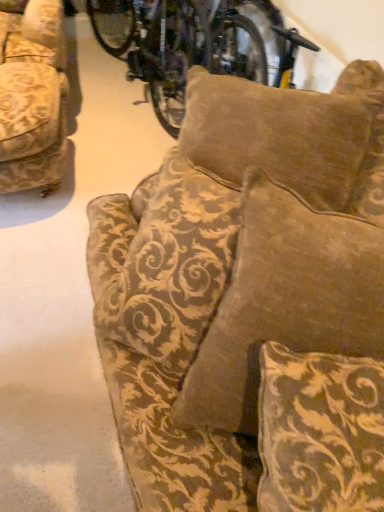
Locate an element on the screen. The width and height of the screenshot is (384, 512). gold-patterned fabric couch at left, positioned as the 1th studio couch in left-to-right order is located at coordinates (33, 100).

What is the approximate height of velvet gold-patterned couch at center, which is the first studio couch from bottom to top?

It is 69.90 centimeters.

Find the location of `metallic silver bicycle at upper center`. metallic silver bicycle at upper center is located at coordinates (191, 45).

This screenshot has height=512, width=384. Describe the element at coordinates (191, 45) in the screenshot. I see `metallic silver bicycle at upper center` at that location.

In order to face velvet gold-patterned pillow at center, the 1th pillow from the front, should I rotate leftwards or rightwards?

Turn right approximately 20.818 degrees to face it.

This screenshot has height=512, width=384. I want to click on gold-patterned fabric couch at left, which is the second studio couch from bottom to top, so click(33, 100).

Is metallic silver bicycle at upper center shorter than brown velvety pillow at upper center, the 2th pillow from the front?

Correct, metallic silver bicycle at upper center is not as tall as brown velvety pillow at upper center, the 2th pillow from the front.

How many degrees apart are the facing directions of metallic silver bicycle at upper center and brown velvety pillow at upper center, the 1th pillow positioned from the back?

The angular difference between metallic silver bicycle at upper center and brown velvety pillow at upper center, the 1th pillow positioned from the back, is 0.000387 degrees.

In terms of width, does metallic silver bicycle at upper center look wider or thinner when compared to brown velvety pillow at upper center, the 1th pillow positioned from the back?

In the image, metallic silver bicycle at upper center appears to be more narrow than brown velvety pillow at upper center, the 1th pillow positioned from the back.

From a real-world perspective, is metallic silver bicycle at upper center positioned under brown velvety pillow at upper center, which is the 1th pillow in top-to-bottom order, based on gravity?

Correct, in the physical world, metallic silver bicycle at upper center is lower than brown velvety pillow at upper center, which is the 1th pillow in top-to-bottom order.

In the scene shown: From a real-world perspective, is velvet gold-patterned couch at center, positioned as the first studio couch in right-to-left order, physically located above or below metallic silver bicycle at upper center?

velvet gold-patterned couch at center, positioned as the first studio couch in right-to-left order, is situated higher than metallic silver bicycle at upper center in the real world.

Based on their positions, is velvet gold-patterned couch at center, marked as the 2th studio couch in a left-to-right arrangement, located to the left or right of metallic silver bicycle at upper center?

In the image, velvet gold-patterned couch at center, marked as the 2th studio couch in a left-to-right arrangement, appears on the right side of metallic silver bicycle at upper center.

Is point (178, 329) positioned after point (186, 65)?

No, (178, 329) is closer to viewer.

Locate an element on the screen. The image size is (384, 512). bicycle directly beneath the velvet gold-patterned couch at center, arranged as the first studio couch when viewed from the front (from a real-world perspective) is located at coordinates (191, 45).

This screenshot has width=384, height=512. What are the coordinates of `bicycle on the right side of gold-patterned fabric couch at left, marked as the second studio couch in a right-to-left arrangement` in the screenshot? It's located at (191, 45).

From a real-world perspective, is gold-patterned fabric couch at left, positioned as the 1th studio couch in left-to-right order, physically located above or below metallic silver bicycle at upper center?

Clearly, from a real-world perspective, gold-patterned fabric couch at left, positioned as the 1th studio couch in left-to-right order, is below metallic silver bicycle at upper center.

Consider the image. Could you tell me if gold-patterned fabric couch at left, which ranks as the 1th studio couch in top-to-bottom order, is turned towards metallic silver bicycle at upper center?

No, gold-patterned fabric couch at left, which ranks as the 1th studio couch in top-to-bottom order, is not oriented towards metallic silver bicycle at upper center.

What's the angular difference between brown velvety pillow at upper center, the 2th pillow from the front, and velvet gold-patterned pillow at center, the 1th pillow from the front,'s facing directions?

The angle between the facing direction of brown velvety pillow at upper center, the 2th pillow from the front, and the facing direction of velvet gold-patterned pillow at center, the 1th pillow from the front, is 73.1 degrees.

Considering the relative sizes of brown velvety pillow at upper center, the 1th pillow positioned from the back, and velvet gold-patterned pillow at center, the second pillow in the back-to-front sequence, in the image provided, is brown velvety pillow at upper center, the 1th pillow positioned from the back, wider than velvet gold-patterned pillow at center, the second pillow in the back-to-front sequence,?

Yes.

Does brown velvety pillow at upper center, placed as the 2th pillow when sorted from bottom to top, come behind velvet gold-patterned pillow at center, the second pillow in the back-to-front sequence?

Yes, it is.

Does brown velvety pillow at upper center, which is the 1th pillow in top-to-bottom order, turn towards velvet gold-patterned pillow at center, which is the first pillow in bottom-to-top order?

No.

Who is more distant, velvet gold-patterned pillow at center, the 2th pillow when ordered from top to bottom, or velvet gold-patterned couch at center, arranged as the first studio couch when viewed from the front?

velvet gold-patterned pillow at center, the 2th pillow when ordered from top to bottom, is further from the camera.

Which object is wider, velvet gold-patterned pillow at center, the 1th pillow from the front, or velvet gold-patterned couch at center, positioned as the first studio couch in right-to-left order?

velvet gold-patterned couch at center, positioned as the first studio couch in right-to-left order, is wider.

From the image's perspective, would you say velvet gold-patterned pillow at center, the second pillow in the back-to-front sequence, is shown under velvet gold-patterned couch at center, which is the first studio couch from bottom to top?

Yes.

Is velvet gold-patterned pillow at center, the 2th pillow when ordered from top to bottom, to the left or to the right of velvet gold-patterned couch at center, positioned as the first studio couch in right-to-left order, in the image?

From the image, it's evident that velvet gold-patterned pillow at center, the 2th pillow when ordered from top to bottom, is to the right of velvet gold-patterned couch at center, positioned as the first studio couch in right-to-left order.

In the scene shown: Is brown velvety pillow at upper center, the 2th pillow from the front, completely or partially outside of velvet gold-patterned couch at center, positioned as the first studio couch in right-to-left order?

Indeed, brown velvety pillow at upper center, the 2th pillow from the front, is completely outside velvet gold-patterned couch at center, positioned as the first studio couch in right-to-left order.

Is brown velvety pillow at upper center, placed as the 2th pillow when sorted from bottom to top, aimed at velvet gold-patterned couch at center, positioned as the first studio couch in right-to-left order?

No, brown velvety pillow at upper center, placed as the 2th pillow when sorted from bottom to top, does not turn towards velvet gold-patterned couch at center, positioned as the first studio couch in right-to-left order.

Identify the location of studio couch on the right of brown velvety pillow at upper center, the 2th pillow from the front. The height and width of the screenshot is (512, 384). (236, 273).

From the image's perspective, which object appears higher, brown velvety pillow at upper center, the 2th pillow from the front, or velvet gold-patterned couch at center, positioned as the first studio couch in right-to-left order?

brown velvety pillow at upper center, the 2th pillow from the front, from the image's perspective.

Considering the relative sizes of brown velvety pillow at upper center, the 2th pillow from the front, and gold-patterned fabric couch at left, positioned as the 1th studio couch in left-to-right order, in the image provided, is brown velvety pillow at upper center, the 2th pillow from the front, wider than gold-patterned fabric couch at left, positioned as the 1th studio couch in left-to-right order,?

No, brown velvety pillow at upper center, the 2th pillow from the front, is not wider than gold-patterned fabric couch at left, positioned as the 1th studio couch in left-to-right order.

Is brown velvety pillow at upper center, the 1th pillow positioned from the back, facing towards gold-patterned fabric couch at left, which is the second studio couch from bottom to top?

Yes, brown velvety pillow at upper center, the 1th pillow positioned from the back, is oriented towards gold-patterned fabric couch at left, which is the second studio couch from bottom to top.

Locate an element on the screen. The width and height of the screenshot is (384, 512). studio couch below the brown velvety pillow at upper center, which is the 1th pillow in top-to-bottom order (from a real-world perspective) is located at coordinates 33,100.

From the image's perspective, is brown velvety pillow at upper center, which is the 1th pillow in top-to-bottom order, located beneath gold-patterned fabric couch at left, which is the second studio couch from bottom to top?

No, from the image's perspective, brown velvety pillow at upper center, which is the 1th pillow in top-to-bottom order, is not beneath gold-patterned fabric couch at left, which is the second studio couch from bottom to top.

This screenshot has height=512, width=384. I want to click on bicycle directly beneath the brown velvety pillow at upper center, which is the 1th pillow in top-to-bottom order (from a real-world perspective), so click(191, 45).

This screenshot has width=384, height=512. I want to click on the 2nd studio couch in front of the metallic silver bicycle at upper center, so click(x=236, y=273).

From the image, which object appears to be farther from gold-patterned fabric couch at left, which is the first studio couch from back to front, velvet gold-patterned couch at center, positioned as the first studio couch in right-to-left order, or brown velvety pillow at upper center, the 1th pillow positioned from the back?

The object further to gold-patterned fabric couch at left, which is the first studio couch from back to front, is velvet gold-patterned couch at center, positioned as the first studio couch in right-to-left order.

Based on their spatial positions, is brown velvety pillow at upper center, the 2th pillow from the front, or velvet gold-patterned couch at center, positioned as the first studio couch in right-to-left order, further from velvet gold-patterned pillow at center, which is the first pillow in bottom-to-top order?

brown velvety pillow at upper center, the 2th pillow from the front, is further to velvet gold-patterned pillow at center, which is the first pillow in bottom-to-top order.

Estimate the real-world distances between objects in this image. Which object is closer to metallic silver bicycle at upper center, velvet gold-patterned pillow at center, the 2th pillow when ordered from top to bottom, or velvet gold-patterned couch at center, positioned as the first studio couch in right-to-left order?

The object closer to metallic silver bicycle at upper center is velvet gold-patterned couch at center, positioned as the first studio couch in right-to-left order.

Which object lies nearer to the anchor point gold-patterned fabric couch at left, which ranks as the 1th studio couch in top-to-bottom order, velvet gold-patterned pillow at center, the 1th pillow from the front, or velvet gold-patterned couch at center, arranged as the first studio couch when viewed from the front?

The object closer to gold-patterned fabric couch at left, which ranks as the 1th studio couch in top-to-bottom order, is velvet gold-patterned couch at center, arranged as the first studio couch when viewed from the front.

From the image, which object appears to be farther from gold-patterned fabric couch at left, marked as the second studio couch in a right-to-left arrangement, velvet gold-patterned couch at center, positioned as the first studio couch in right-to-left order, or metallic silver bicycle at upper center?

velvet gold-patterned couch at center, positioned as the first studio couch in right-to-left order.

From the image, which object appears to be nearer to velvet gold-patterned couch at center, acting as the second studio couch starting from the top, gold-patterned fabric couch at left, positioned as the 1th studio couch in left-to-right order, or metallic silver bicycle at upper center?

Based on the image, gold-patterned fabric couch at left, positioned as the 1th studio couch in left-to-right order, appears to be nearer to velvet gold-patterned couch at center, acting as the second studio couch starting from the top.

Which object lies further to the anchor point velvet gold-patterned couch at center, arranged as the first studio couch when viewed from the front, gold-patterned fabric couch at left, marked as the second studio couch in a right-to-left arrangement, or velvet gold-patterned pillow at center, the 1th pillow from the front?

The object further to velvet gold-patterned couch at center, arranged as the first studio couch when viewed from the front, is gold-patterned fabric couch at left, marked as the second studio couch in a right-to-left arrangement.

When comparing their distances from gold-patterned fabric couch at left, which is the second studio couch from bottom to top, does brown velvety pillow at upper center, placed as the 2th pillow when sorted from bottom to top, or velvet gold-patterned couch at center, positioned as the first studio couch in right-to-left order, seem further?

velvet gold-patterned couch at center, positioned as the first studio couch in right-to-left order, lies further to gold-patterned fabric couch at left, which is the second studio couch from bottom to top, than the other object.

At what (x,y) coordinates should I click in order to perform the action: click on pillow between metallic silver bicycle at upper center and gold-patterned fabric couch at left, the 2th studio couch viewed from the front, from top to bottom. Please return your answer as a coordinate pair (x, y). The height and width of the screenshot is (512, 384). Looking at the image, I should click on (293, 136).

Where is `studio couch between metallic silver bicycle at upper center and velvet gold-patterned couch at center, acting as the second studio couch starting from the top, in the vertical direction`? The image size is (384, 512). studio couch between metallic silver bicycle at upper center and velvet gold-patterned couch at center, acting as the second studio couch starting from the top, in the vertical direction is located at coordinates (33, 100).

Find the location of a particular element. Image resolution: width=384 pixels, height=512 pixels. pillow between metallic silver bicycle at upper center and velvet gold-patterned pillow at center, the 2th pillow when ordered from top to bottom, in the vertical direction is located at coordinates (293, 136).

Where is `pillow that lies between metallic silver bicycle at upper center and velvet gold-patterned couch at center, which is the first studio couch from bottom to top, from top to bottom`? pillow that lies between metallic silver bicycle at upper center and velvet gold-patterned couch at center, which is the first studio couch from bottom to top, from top to bottom is located at coordinates (293, 136).